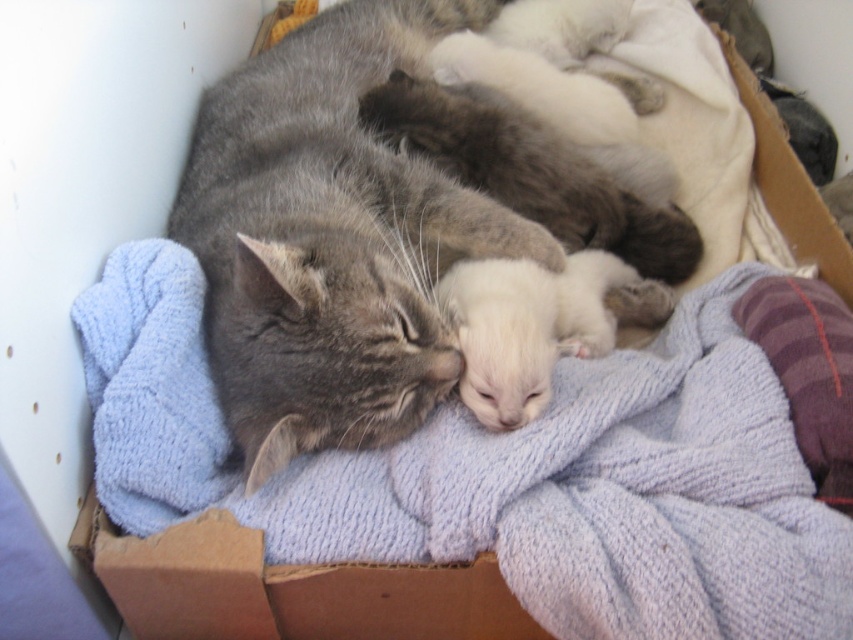
You are a photographer trying to capture a closeup of the white soft kitten at center without moving the gray tabby cat at center. Based on their positions, which side of the box should you approach from?

The gray tabby cat at center is to the left of the white soft kitten at center, so you should approach from the right side of the box to avoid disturbing the gray tabby cat at center and get a clear shot of the white soft kitten at center.

Consider the image. You are a photographer trying to capture a closeup of the two cats in the cardboard box. You notice two specific points marked in the image. Which point, point (392, 67) or point (538, 316), is closer to your camera lens?

Point (392, 67) is closer to the camera lens because it is further to the viewer than point (538, 316).